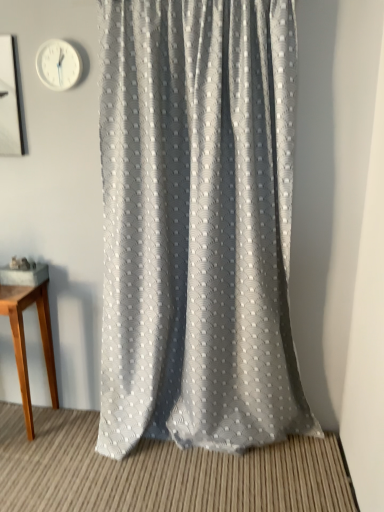
The image size is (384, 512). Identify the location of vacant space to the right of light brown wooden table at left. (69, 430).